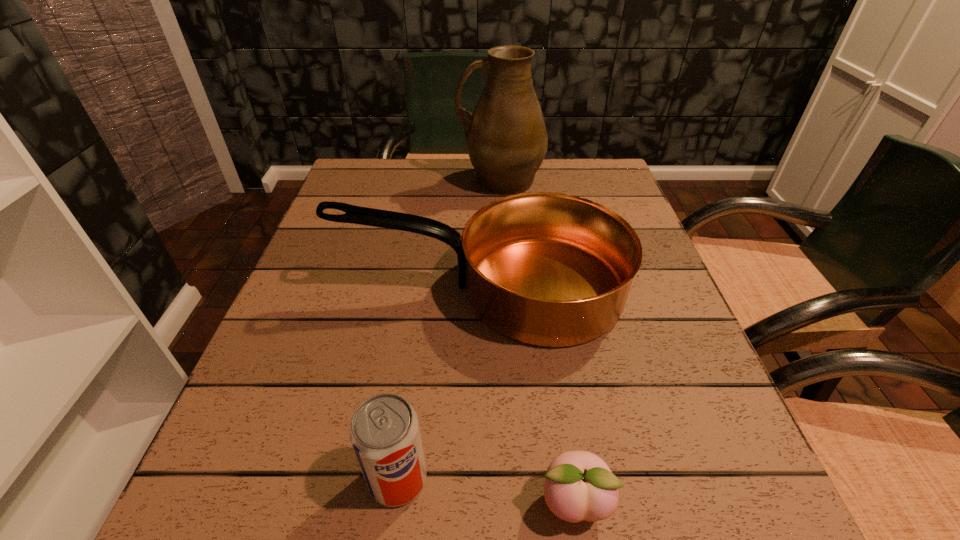
The height and width of the screenshot is (540, 960). In order to click on vacant space located 0.090m on the handle side of the second tallest object in this screenshot , I will do `click(296, 288)`.

Where is `free spot located 0.260m on the right of the second shortest object`? free spot located 0.260m on the right of the second shortest object is located at coordinates (613, 478).

The image size is (960, 540). I want to click on free spot located 0.080m on the left of the shortest object, so click(479, 502).

This screenshot has height=540, width=960. Find the location of `object that is at the far edge`. object that is at the far edge is located at coordinates point(506,138).

Where is `soda at the near edge`? soda at the near edge is located at coordinates (385, 435).

I want to click on peach that is at the near edge, so click(x=579, y=485).

Locate an element on the screen. This screenshot has height=540, width=960. object at the left edge is located at coordinates (547, 269).

Find the location of a particular element. The height and width of the screenshot is (540, 960). object that is at the right edge is located at coordinates (547, 269).

Find the location of `vacant region at the far edge`. vacant region at the far edge is located at coordinates (427, 166).

The height and width of the screenshot is (540, 960). In the image, there is a desktop. Find the location of `vacant region at the near edge`. vacant region at the near edge is located at coordinates (395, 539).